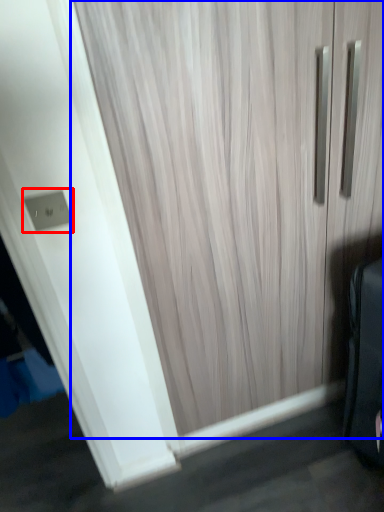
Question: Which object is closer to the camera taking this photo, electric outlet (highlighted by a red box) or door (highlighted by a blue box)?

Choices:
 (A) electric outlet
 (B) door

Answer: (B)